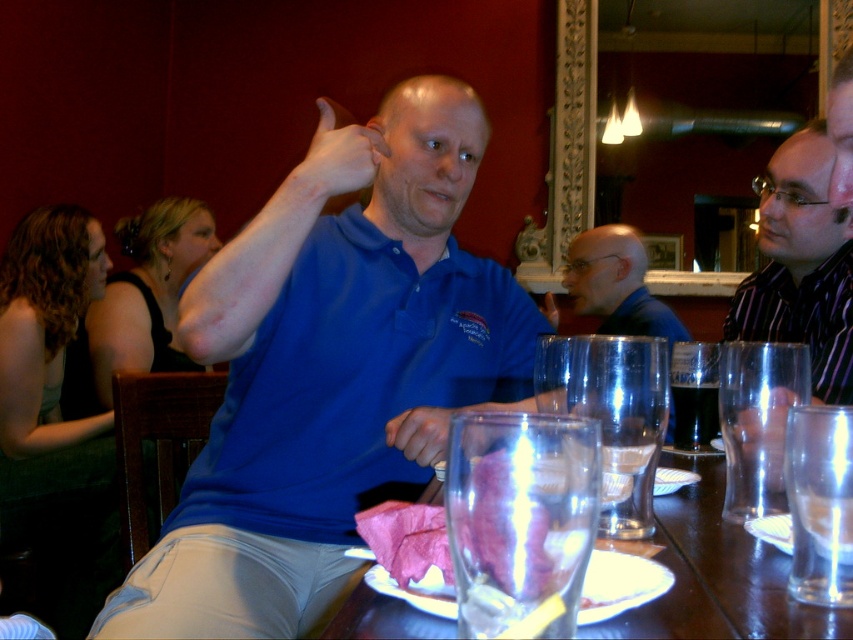
You are taking a photo of the scene and want to focus on both point [549,435] and point [759,512]. Which point should you focus on first to ensure both are in focus?

You should focus on point [549,435] first because it is closer to the camera than point [759,512], so focusing on the closer point ensures both will be in focus.

You are a waiter at the restaurant and need to place a new drink order at the table. Where should you put it so it doesn not interfere with the existing transparent glass at center?

The transparent glass at center is located at point (x=520, y=520). Place the new drink order away from this coordinate to avoid interference.